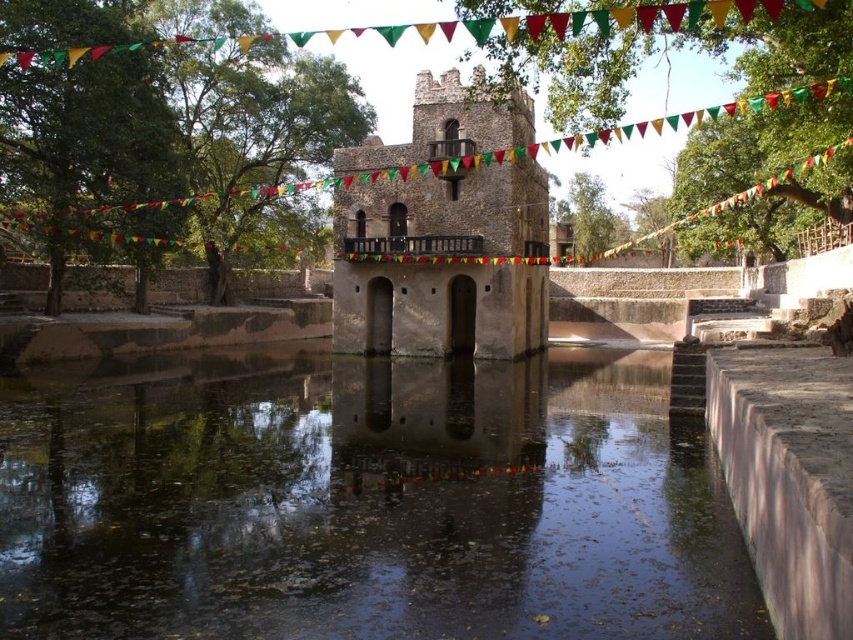
You are a boat operator who needs to navigate a 10 meter long boat through the brown concrete river at center. The boat must pass between the river and the brown stone tower at center. Can the boat safely navigate this passage given the river width?

The brown concrete river at center is wider than the brown stone tower at center, so the boat can safely navigate the passage as the river provides sufficient width for the boat to pass through.

You are standing on the dock and want to walk to the tower. Which direction should you go from the brown concrete river at center to reach the brown stone tower at center?

Since the brown concrete river at center is to the left of the brown stone tower at center, you should walk to the right to reach the brown stone tower at center from the brown concrete river at center.